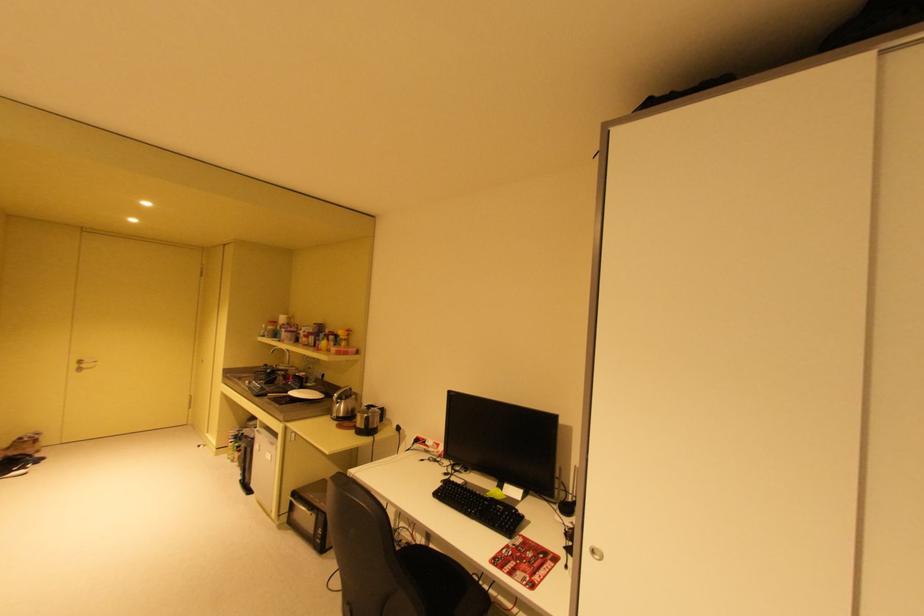
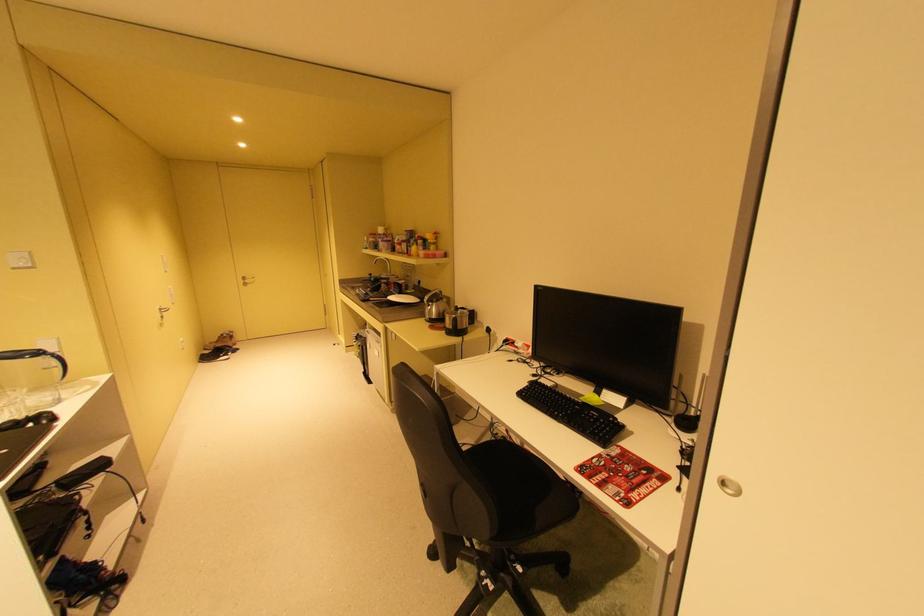
Question: Based on the continuous images, in which direction is the camera rotating? Reply with the corresponding letter.

Choices:
 (A) Left
 (B) Right
 (C) Up
 (D) Down

Answer: (A)